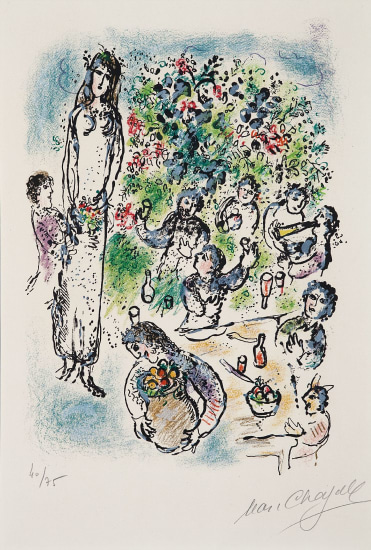
Where is `table bottom right`? table bottom right is located at coordinates (260, 436).